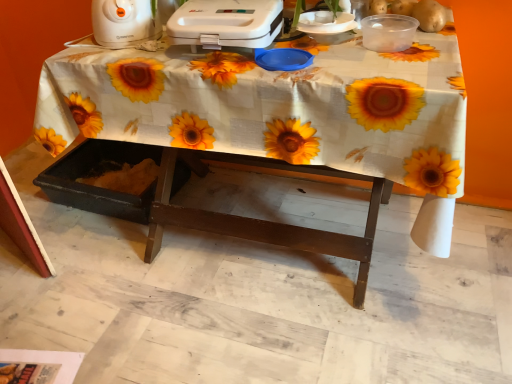
Question: Is white plastic toaster at upper center, which is the 2th appliance from left to right, surrounding white plastic toaster at upper left, positioned as the first appliance in left-to-right order?

Choices:
 (A) no
 (B) yes

Answer: (A)

Question: Is white plastic toaster at upper center, the 1th appliance in the right-to-left sequence, positioned far away from white plastic toaster at upper left, positioned as the first appliance in left-to-right order?

Choices:
 (A) no
 (B) yes

Answer: (A)

Question: From a real-world perspective, is white plastic toaster at upper center, which is the 2th appliance from left to right, on top of white plastic toaster at upper left, arranged as the 2th appliance when viewed from the right?

Choices:
 (A) no
 (B) yes

Answer: (A)

Question: Is white plastic toaster at upper left, positioned as the first appliance in left-to-right order, at the back of white plastic toaster at upper center, the 1th appliance in the right-to-left sequence?

Choices:
 (A) yes
 (B) no

Answer: (B)

Question: Is white plastic toaster at upper center, which is the 2th appliance from left to right, shorter than white plastic toaster at upper left, positioned as the first appliance in left-to-right order?

Choices:
 (A) yes
 (B) no

Answer: (A)

Question: Is white plastic toaster at upper center, which is the 2th appliance from left to right, oriented towards white plastic toaster at upper left, positioned as the first appliance in left-to-right order?

Choices:
 (A) yes
 (B) no

Answer: (B)

Question: Is white plastic toaster at upper left, positioned as the first appliance in left-to-right order, facing towards white plastic toaster at upper center, which is the 2th appliance from left to right?

Choices:
 (A) yes
 (B) no

Answer: (B)

Question: Is white plastic toaster at upper left, positioned as the first appliance in left-to-right order, positioned with its back to white plastic toaster at upper center, which is the 2th appliance from left to right?

Choices:
 (A) no
 (B) yes

Answer: (A)

Question: Is white plastic toaster at upper left, arranged as the 2th appliance when viewed from the right, taller than white plastic toaster at upper center, the 1th appliance in the right-to-left sequence?

Choices:
 (A) yes
 (B) no

Answer: (A)

Question: Is white plastic toaster at upper left, positioned as the first appliance in left-to-right order, next to white plastic toaster at upper center, the 1th appliance in the right-to-left sequence?

Choices:
 (A) no
 (B) yes

Answer: (A)

Question: From the image's perspective, is white plastic toaster at upper left, arranged as the 2th appliance when viewed from the right, located beneath white plastic toaster at upper center, which is the 2th appliance from left to right?

Choices:
 (A) yes
 (B) no

Answer: (B)

Question: Is white plastic toaster at upper left, positioned as the first appliance in left-to-right order, not close to white plastic toaster at upper center, the 1th appliance in the right-to-left sequence?

Choices:
 (A) yes
 (B) no

Answer: (B)

Question: Considering the relative positions of white fabric-covered table at center and white plastic toaster at upper left, arranged as the 2th appliance when viewed from the right, in the image provided, is white fabric-covered table at center to the left of white plastic toaster at upper left, arranged as the 2th appliance when viewed from the right, from the viewer's perspective?

Choices:
 (A) yes
 (B) no

Answer: (B)